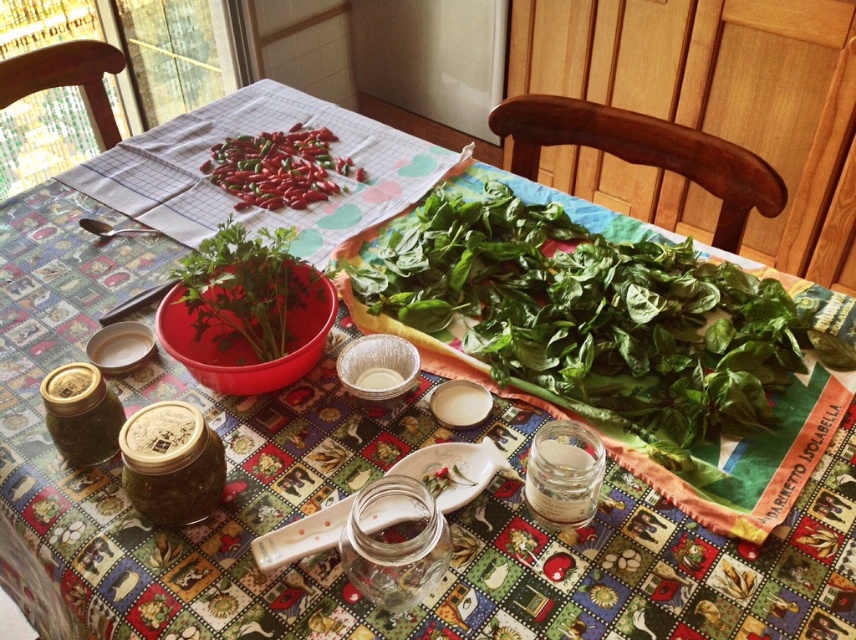
Question: Which point is farther from the camera taking this photo?

Choices:
 (A) (319, 289)
 (B) (298, 154)

Answer: (B)

Question: Is green leafy vegetable at center bigger than green leafy plant at center?

Choices:
 (A) yes
 (B) no

Answer: (A)

Question: Is green leafy plant at center to the left of red matte chili peppers at center from the viewer's perspective?

Choices:
 (A) yes
 (B) no

Answer: (B)

Question: Does green leafy vegetable at center have a lesser width compared to red matte chili peppers at center?

Choices:
 (A) no
 (B) yes

Answer: (A)

Question: Which object appears closest to the camera in this image?

Choices:
 (A) red matte chili peppers at center
 (B) green leafy plant at center
 (C) green leafy vegetable at center

Answer: (C)

Question: Which object appears closest to the camera in this image?

Choices:
 (A) green leafy plant at center
 (B) green leafy vegetable at center
 (C) red matte chili peppers at center

Answer: (B)